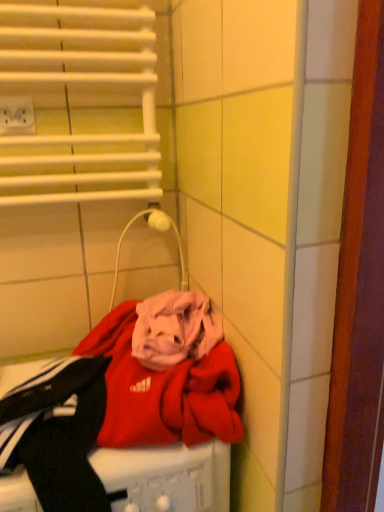
Question: Considering the relative positions of white plastic outlet at upper left and red fabric washing machine at lower left in the image provided, is white plastic outlet at upper left to the left of red fabric washing machine at lower left from the viewer's perspective?

Choices:
 (A) no
 (B) yes

Answer: (B)

Question: Is white plastic outlet at upper left thinner than red fabric washing machine at lower left?

Choices:
 (A) no
 (B) yes

Answer: (B)

Question: Is white plastic outlet at upper left positioned before red fabric washing machine at lower left?

Choices:
 (A) no
 (B) yes

Answer: (A)

Question: From a real-world perspective, is white plastic outlet at upper left physically above red fabric washing machine at lower left?

Choices:
 (A) no
 (B) yes

Answer: (B)

Question: Is white plastic outlet at upper left placed right next to red fabric washing machine at lower left?

Choices:
 (A) no
 (B) yes

Answer: (A)

Question: Is white plastic outlet at upper left at the right side of red fabric washing machine at lower left?

Choices:
 (A) yes
 (B) no

Answer: (B)

Question: Is red fabric washing machine at lower left looking in the opposite direction of white plastic outlet at upper left?

Choices:
 (A) no
 (B) yes

Answer: (A)

Question: From the image's perspective, would you say red fabric washing machine at lower left is shown under white plastic outlet at upper left?

Choices:
 (A) no
 (B) yes

Answer: (B)

Question: Does red fabric washing machine at lower left have a lesser height compared to white plastic outlet at upper left?

Choices:
 (A) no
 (B) yes

Answer: (A)

Question: Is red fabric washing machine at lower left at the right side of white plastic outlet at upper left?

Choices:
 (A) no
 (B) yes

Answer: (B)

Question: Does red fabric washing machine at lower left lie behind white plastic outlet at upper left?

Choices:
 (A) yes
 (B) no

Answer: (B)

Question: Is the surface of red fabric washing machine at lower left in direct contact with white plastic outlet at upper left?

Choices:
 (A) no
 (B) yes

Answer: (A)

Question: Relative to white plastic outlet at upper left, is red fabric washing machine at lower left in front or behind?

Choices:
 (A) front
 (B) behind

Answer: (A)